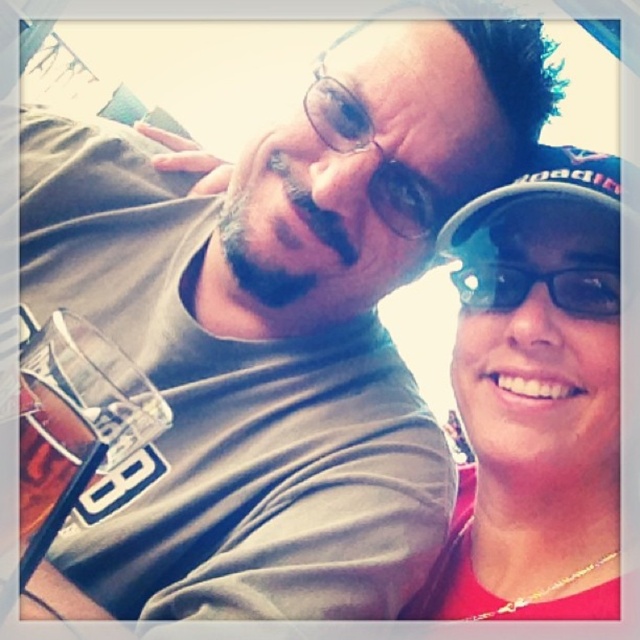
From the picture: You are a photographer standing at the edge of the scene. You want to take a picture of the two people while ensuring the matte black glasses at center are clearly visible in the frame. Where should you position yourself to capture both the people and the glasses without any obstruction?

Position yourself at the edge of the scene facing towards the center where the matte black glasses at center are located at point (364, 148). This ensures both the two people and the glasses are in the frame without obstruction.

You are a photographer taking a picture of the two people in the scene. You notice an object at point [364,148]. What object is located at that point?

The object at point [364,148] is matte black glasses at center.